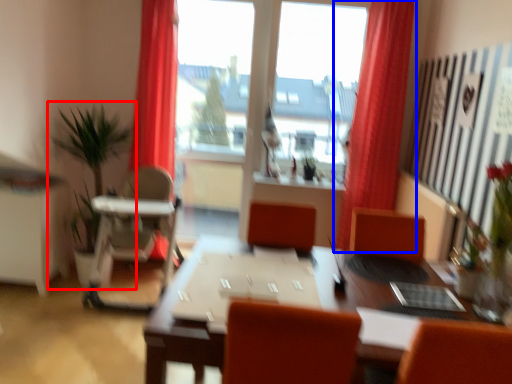
Question: Which object appears closest to the camera in this image, houseplant (highlighted by a red box) or curtain (highlighted by a blue box)?

Choices:
 (A) houseplant
 (B) curtain

Answer: (A)